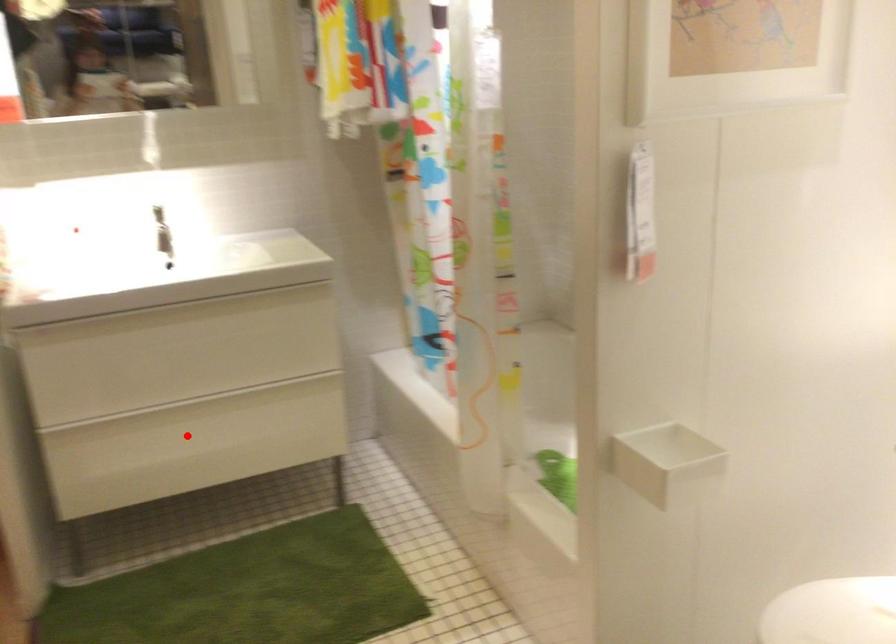
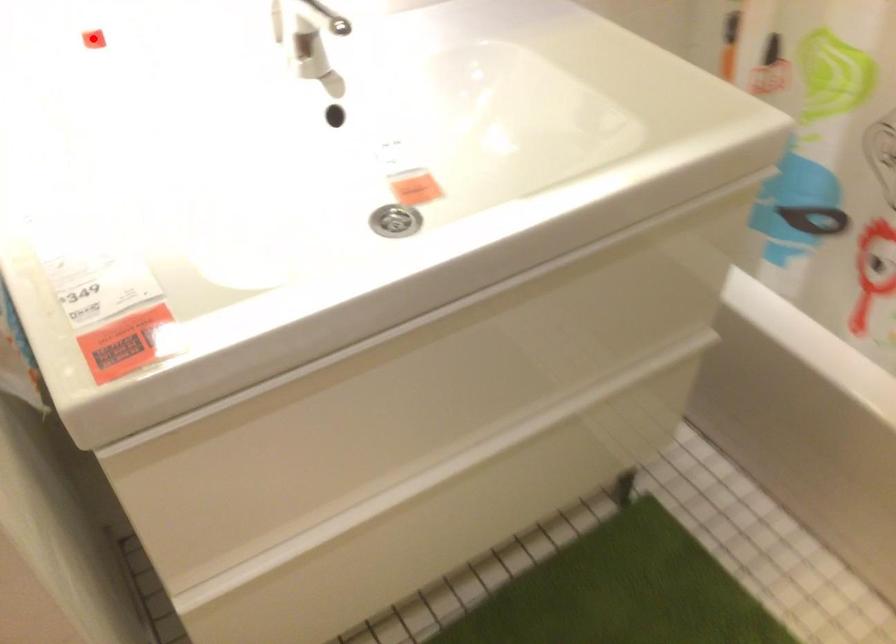
I am providing you with two images of the same scene from different viewpoints. A red point is marked on the first image and another point is marked on the second image. Does the point marked in image1 correspond to the same location as the one in image2?

No